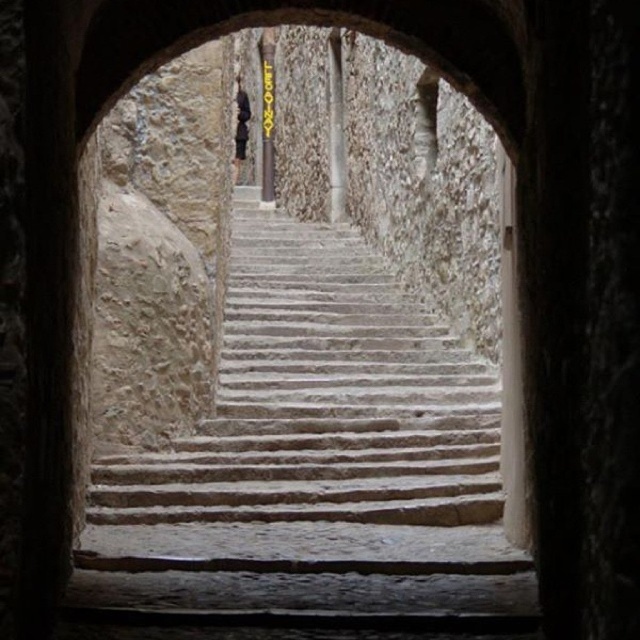
You are standing in a room and see an arched opening ahead. Through it, you can see white stone stairs at center and a dark fabric figure at center. Which object takes up more space in the scene?

The dark fabric figure at center takes up more space in the scene than the white stone stairs at center because the white stone stairs at center occupies less space than dark fabric figure at center.

Based on the photo, you are standing in front of the arched opening and want to determine the position of two points marked on the stone staircase. Which of the two points, point (326, 460) or point (237, 170), is closer to you?

Point (326, 460) is closer to the camera than point (237, 170).

You are standing in front of an arched opening leading to a narrow stone staircase. You see a white stone stairs at center and a dark fabric figure at center. Which object is positioned to the right side from your perspective?

The white stone stairs at center is to the right of dark fabric figure at center, so the white stone stairs at center is positioned to the right side from your perspective.